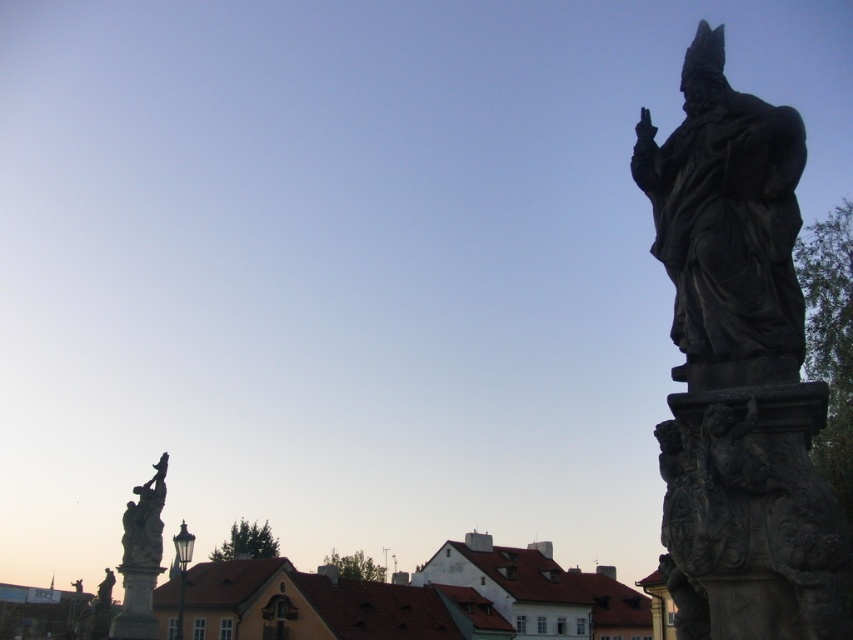
Consider the image. Can you confirm if brown tiled roofs at lower center is bigger than dark gray stone statue at right?

Indeed, brown tiled roofs at lower center has a larger size compared to dark gray stone statue at right.

Measure the distance between brown tiled roofs at lower center and dark gray stone statue at right.

brown tiled roofs at lower center is 119.63 meters from dark gray stone statue at right.

Is point (410, 588) closer to camera compared to point (704, 332)?

No, it is behind (704, 332).

Locate an element on the screen. Image resolution: width=853 pixels, height=640 pixels. brown tiled roofs at lower center is located at coordinates (415, 600).

Is point (751, 564) farther from viewer compared to point (163, 467)?

No, it is in front of (163, 467).

At what (x,y) coordinates should I click in order to perform the action: click on black stone statue at right. Please return your answer as a coordinate pair (x, y). Image resolution: width=853 pixels, height=640 pixels. Looking at the image, I should click on (740, 371).

Does black stone statue at right appear on the right side of brown tiled roofs at lower center?

Indeed, black stone statue at right is positioned on the right side of brown tiled roofs at lower center.

Which is behind, point (653, 241) or point (492, 636)?

The point (653, 241) is behind.

I want to click on black stone statue at right, so click(740, 371).